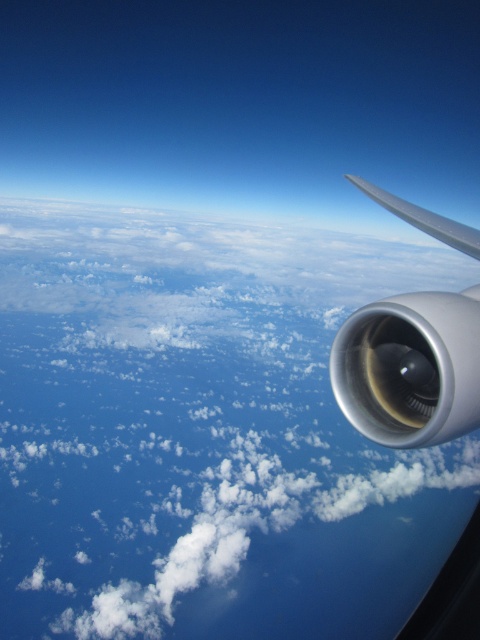
From the picture: Is sleek metallic engine at right to the left of silver metallic wing at upper right from the viewer's perspective?

Correct, you'll find sleek metallic engine at right to the left of silver metallic wing at upper right.

Which is in front, point (458, 317) or point (466, 244)?

Positioned in front is point (458, 317).

At what (x,y) coordinates should I click in order to perform the action: click on sleek metallic engine at right. Please return your answer as a coordinate pair (x, y). The height and width of the screenshot is (640, 480). Looking at the image, I should click on (410, 368).

Is white fluffy cloud at upper center to the left of sleek metallic engine at right from the viewer's perspective?

In fact, white fluffy cloud at upper center is to the right of sleek metallic engine at right.

Who is more distant from viewer, (319, 378) or (416, 358)?

The point (319, 378) is more distant.

The width and height of the screenshot is (480, 640). What are the coordinates of `white fluffy cloud at upper center` in the screenshot? It's located at (x=204, y=433).

Looking at this image, is white fluffy cloud at upper center to the left of silver metallic wing at upper right from the viewer's perspective?

In fact, white fluffy cloud at upper center is to the right of silver metallic wing at upper right.

Which is above, white fluffy cloud at upper center or silver metallic wing at upper right?

white fluffy cloud at upper center is higher up.

Is point (238, 272) less distant than point (432, 225)?

No, it is behind (432, 225).

Image resolution: width=480 pixels, height=640 pixels. In order to click on white fluffy cloud at upper center in this screenshot , I will do `click(204, 433)`.